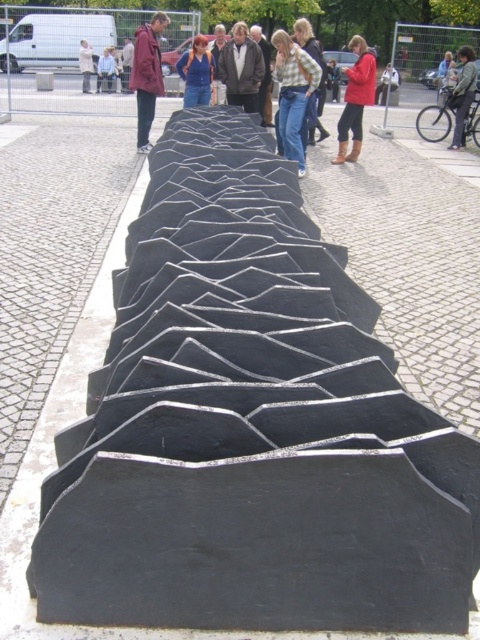
Which is behind, point (365, 58) or point (334, 72)?

The point (334, 72) is more distant.

Which is above, red leather jacket at center or denim jacket at upper center?

Positioned higher is red leather jacket at center.

Is point (364, 72) farther from viewer compared to point (328, 61)?

No.

Identify the location of red leather jacket at center. (356, 99).

Between matte red jacket at center and matte black sculpture at center, which one has less height?

With less height is matte red jacket at center.

Does matte red jacket at center have a greater height compared to matte black sculpture at center?

No.

Where is `matte red jacket at center`? This screenshot has height=640, width=480. matte red jacket at center is located at coordinates (146, 76).

Can you confirm if denim jeans at center is positioned above matte black jacket at upper center?

No.

Is denim jeans at center positioned before matte black jacket at upper center?

That is True.

In order to click on denim jeans at center in this screenshot , I will do `click(292, 93)`.